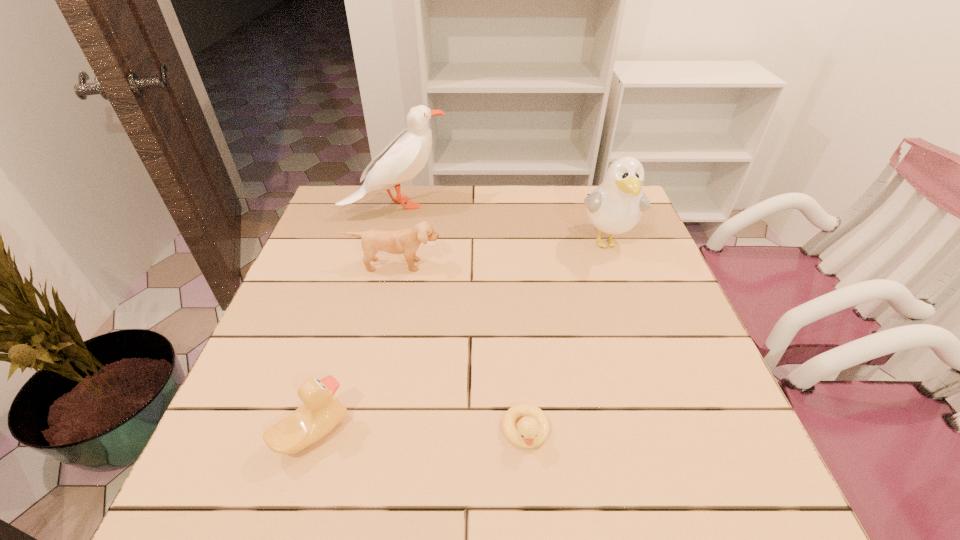
At what (x,y) coordinates should I click in order to perform the action: click on vacant point that satisfies the following two spatial constraints: 1. on the beak of the nearer gull; 2. at the beak of the duck. Please return your answer as a coordinate pair (x, y). Looking at the image, I should click on (673, 432).

Find the location of `free space that satisfies the following two spatial constraints: 1. at the beak of the duckling; 2. at the beak of the duck`. free space that satisfies the following two spatial constraints: 1. at the beak of the duckling; 2. at the beak of the duck is located at coordinates (526, 432).

Locate an element on the screen. free spot that satisfies the following two spatial constraints: 1. on the left side of the puppy; 2. at the beak of the duck is located at coordinates (358, 432).